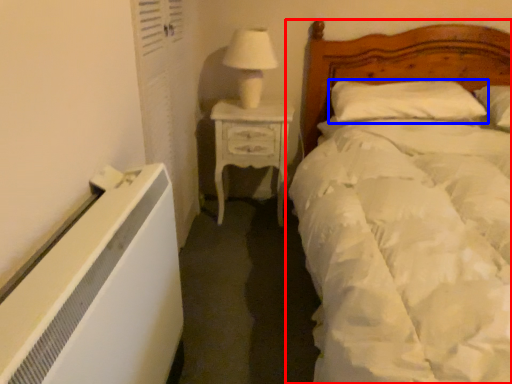
Question: Which object is closer to the camera taking this photo, bed (highlighted by a red box) or pillow (highlighted by a blue box)?

Choices:
 (A) bed
 (B) pillow

Answer: (A)